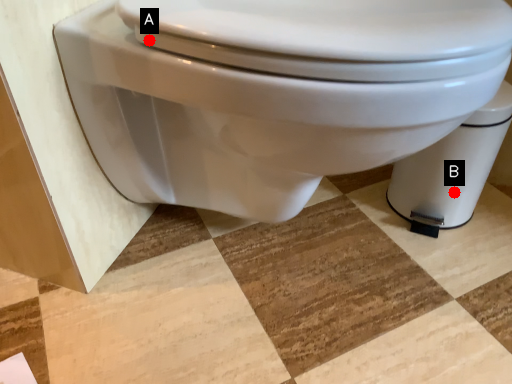
Question: Two points are circled on the image, labeled by A and B beside each circle. Which point is farther to the camera?

Choices:
 (A) A is further
 (B) B is further

Answer: (B)